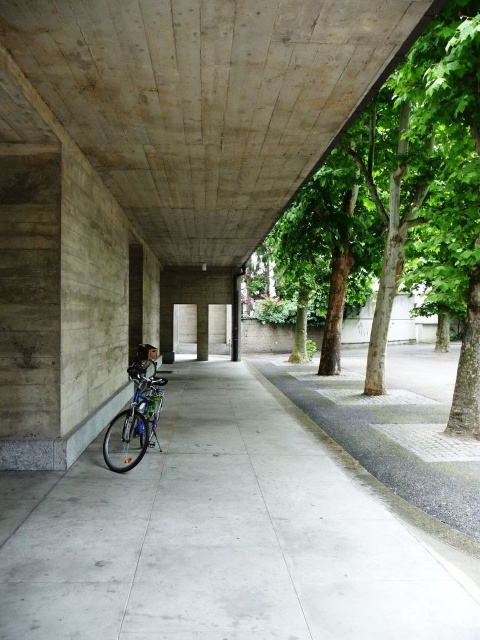
Who is lower down, gray concrete pavement at lower left or shiny blue bicycle at center-left?

gray concrete pavement at lower left is lower down.

Is gray concrete pavement at lower left positioned behind shiny blue bicycle at center-left?

No.

Measure the distance between point (155, 584) and camera.

Point (155, 584) is 3.25 meters away from camera.

At what (x,y) coordinates should I click in order to perform the action: click on gray concrete pavement at lower left. Please return your answer as a coordinate pair (x, y). This screenshot has height=640, width=480. Looking at the image, I should click on (223, 536).

Can you confirm if concrete ceiling at upper center is positioned to the right of green leafy tree at center?

In fact, concrete ceiling at upper center is to the left of green leafy tree at center.

Who is lower down, concrete ceiling at upper center or green leafy tree at center?

green leafy tree at center is lower down.

Locate an element on the screen. concrete ceiling at upper center is located at coordinates (205, 100).

Does gray concrete pavement at lower left lie in front of concrete ceiling at upper center?

No, gray concrete pavement at lower left is further to the viewer.

Between gray concrete pavement at lower left and concrete ceiling at upper center, which one appears on the left side from the viewer's perspective?

gray concrete pavement at lower left

At what (x,y) coordinates should I click in order to perform the action: click on gray concrete pavement at lower left. Please return your answer as a coordinate pair (x, y). Looking at the image, I should click on (223, 536).

Locate an element on the screen. The width and height of the screenshot is (480, 640). gray concrete pavement at lower left is located at coordinates (223, 536).